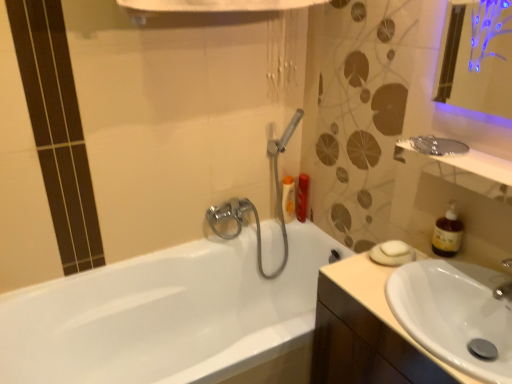
Locate an element on the screen. free space in front of brown translucent soap dispenser at right is located at coordinates (453, 280).